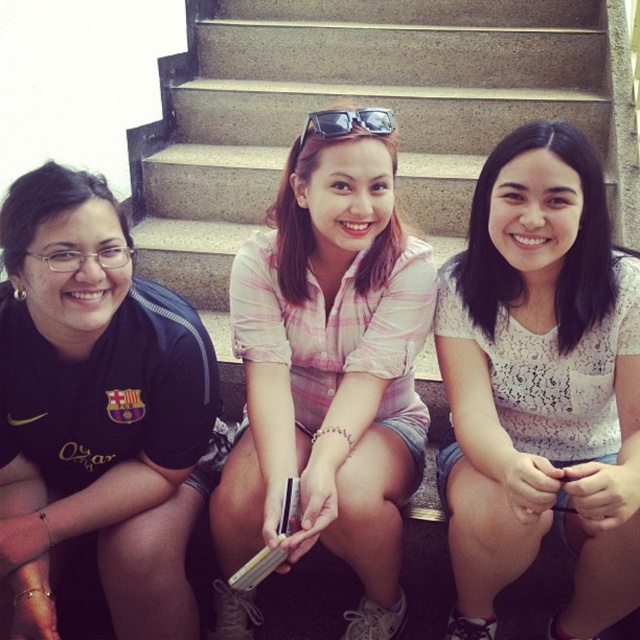
Question: Can you confirm if black matte shirt at left is wider than sunglasses at center?

Choices:
 (A) yes
 (B) no

Answer: (A)

Question: Is black matte shirt at left bigger than sunglasses at center?

Choices:
 (A) no
 (B) yes

Answer: (B)

Question: Among these points, which one is farthest from the camera?

Choices:
 (A) click(268, 413)
 (B) click(320, 125)

Answer: (A)

Question: Which object is the farthest from the sunglasses at center?

Choices:
 (A) black matte shirt at left
 (B) pink plaid shirt at center

Answer: (A)

Question: Which object is the closest to the black matte shirt at left?

Choices:
 (A) pink plaid shirt at center
 (B) white lace blouse at center
 (C) sunglasses at center

Answer: (A)

Question: Is pink plaid shirt at center smaller than sunglasses at center?

Choices:
 (A) yes
 (B) no

Answer: (B)